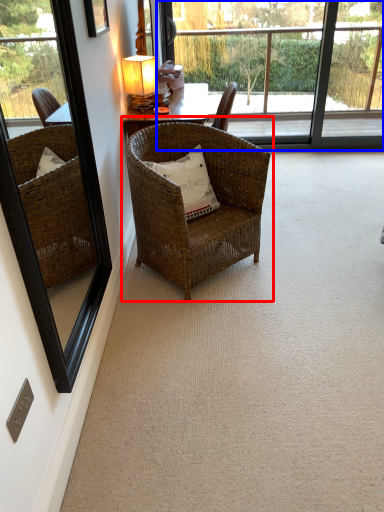
Question: Which object appears closest to the camera in this image, chair (highlighted by a red box) or bay window (highlighted by a blue box)?

Choices:
 (A) chair
 (B) bay window

Answer: (A)